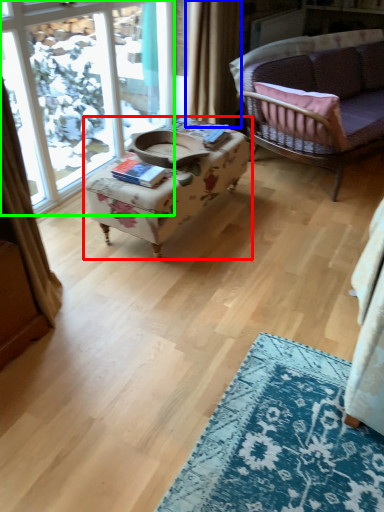
Question: Which object is positioned closest to table (highlighted by a red box)? Select from curtain (highlighted by a blue box) and window (highlighted by a green box).

Choices:
 (A) curtain
 (B) window

Answer: (A)